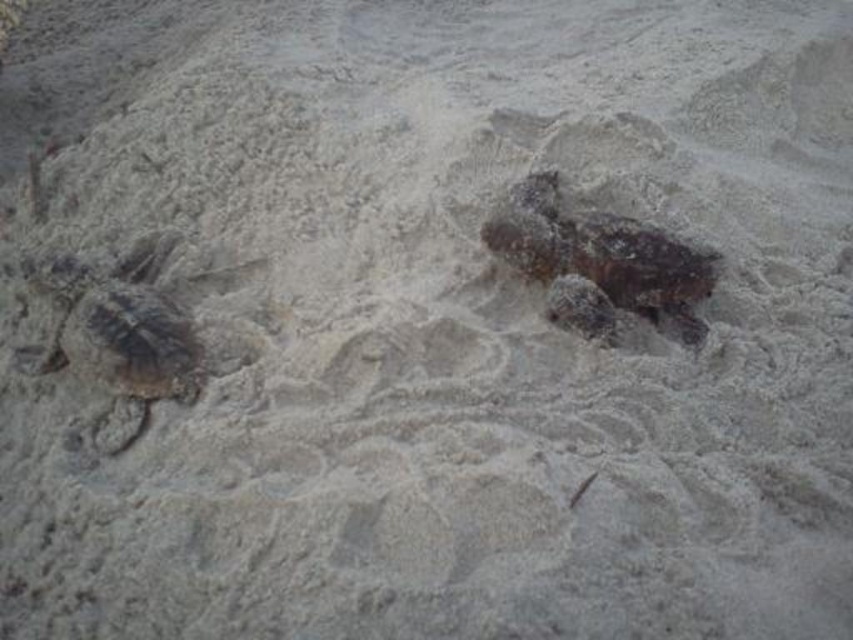
Does dark brown textured turtle at left have a larger size compared to dark brown textured turtle at center?

Indeed, dark brown textured turtle at left has a larger size compared to dark brown textured turtle at center.

Which is more to the left, dark brown textured turtle at left or dark brown textured turtle at center?

From the viewer's perspective, dark brown textured turtle at left appears more on the left side.

Between point (129, 330) and point (602, 269), which one is positioned in front?

Positioned in front is point (129, 330).

Image resolution: width=853 pixels, height=640 pixels. What are the coordinates of `dark brown textured turtle at left` in the screenshot? It's located at (114, 333).